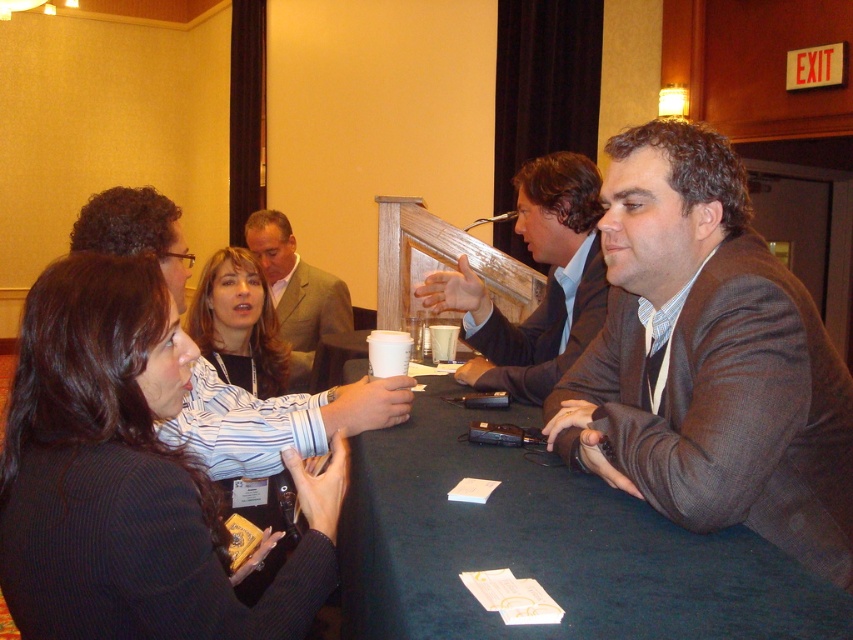
Is striped fabric shirt at center thinner than light brown suit at center?

Yes.

Does point (241, 269) come behind point (299, 337)?

No, it is in front of (299, 337).

The height and width of the screenshot is (640, 853). Find the location of `striped fabric shirt at center`. striped fabric shirt at center is located at coordinates (239, 323).

Which is above, brown woolen suit at center or striped fabric shirt at center?

striped fabric shirt at center

Does point (805, 556) lie in front of point (245, 273)?

That is True.

Who is more distant from viewer, (639, 230) or (264, 356)?

Positioned behind is point (264, 356).

The height and width of the screenshot is (640, 853). Find the location of `brown woolen suit at center`. brown woolen suit at center is located at coordinates (708, 360).

Does black pinstripe blazer at center lie behind dark brown suit at center?

No, it is in front of dark brown suit at center.

Is point (82, 444) farther from camera compared to point (463, 378)?

That is False.

Who is more distant from viewer, (61, 316) or (527, 346)?

The point (527, 346) is more distant.

You are a GUI agent. You are given a task and a screenshot of the screen. Output one action in this format:
    pyautogui.click(x=<x>, y=<y>)
    Task: Click on the black pinstripe blazer at center
    
    Given the screenshot: What is the action you would take?
    pyautogui.click(x=126, y=477)